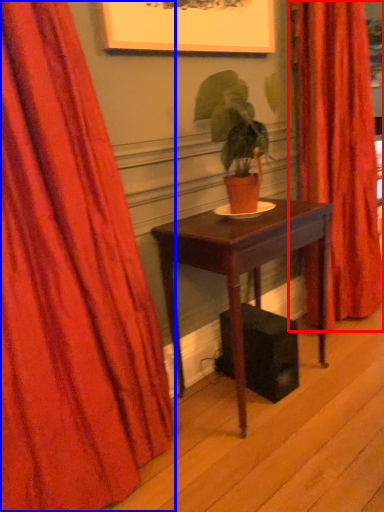
Question: Which object is closer to the camera taking this photo, curtain (highlighted by a red box) or curtain (highlighted by a blue box)?

Choices:
 (A) curtain
 (B) curtain

Answer: (B)